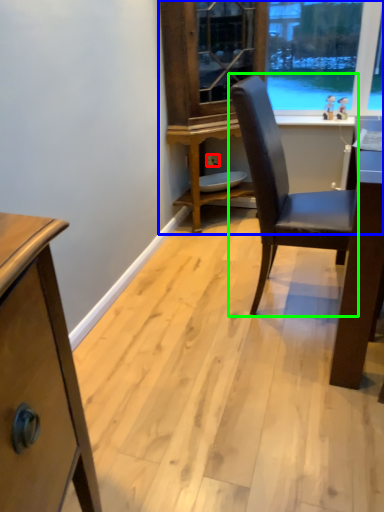
Question: Which is farther away from power outlet (highlighted by a red box)? dresser (highlighted by a blue box) or chair (highlighted by a green box)?

Choices:
 (A) dresser
 (B) chair

Answer: (B)